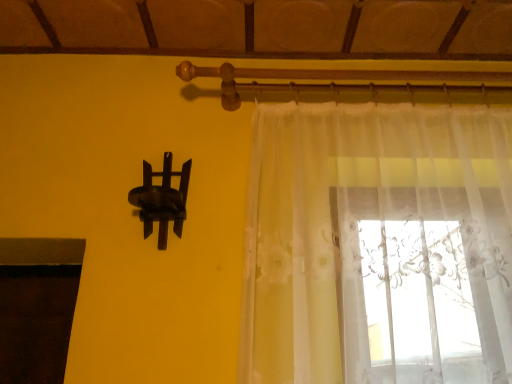
What do you see at coordinates (378, 245) in the screenshot?
I see `sheer white curtain at upper right` at bounding box center [378, 245].

In order to face sheer white curtain at upper right, should I rotate leftwards or rightwards?

Rotate your view right by about 18.967°.

Identify the location of sheer white curtain at upper right. (378, 245).

At what (x,y) coordinates should I click in order to perform the action: click on sheer white curtain at upper right. Please return your answer as a coordinate pair (x, y). The image size is (512, 384). Looking at the image, I should click on (378, 245).